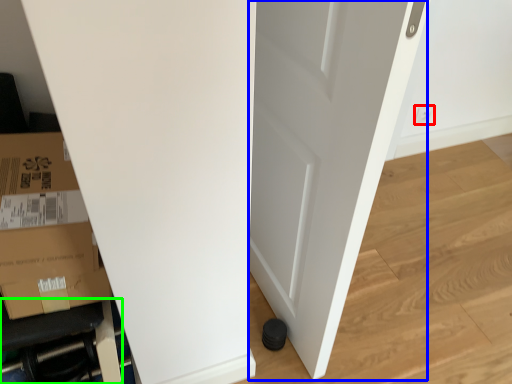
Question: Based on their relative distances, which object is nearer to electric outlet (highlighted by a red box)? Choose from door (highlighted by a blue box) and furniture (highlighted by a green box).

Choices:
 (A) door
 (B) furniture

Answer: (A)